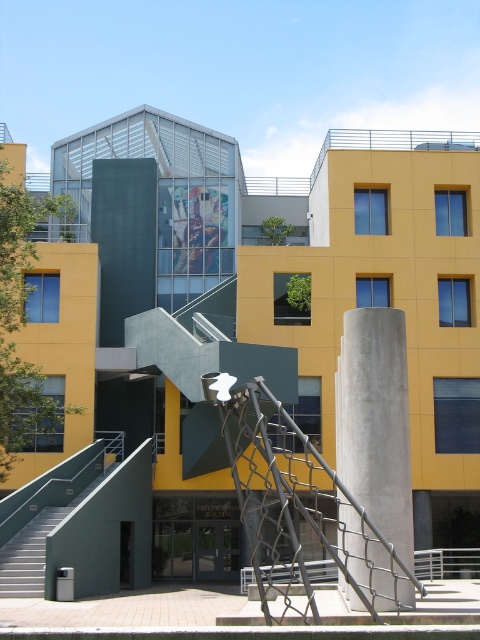
Question: Is concrete at center below smooth concrete stairs at lower left?

Choices:
 (A) no
 (B) yes

Answer: (A)

Question: Among these objects, which one is farthest from the camera?

Choices:
 (A) concrete at center
 (B) smooth concrete stairs at lower left

Answer: (B)

Question: Which point appears closest to the camera in this image?

Choices:
 (A) (338, 385)
 (B) (3, 572)

Answer: (A)

Question: Which object appears closest to the camera in this image?

Choices:
 (A) concrete at center
 (B) smooth concrete stairs at lower left

Answer: (A)

Question: Is concrete at center smaller than smooth concrete stairs at lower left?

Choices:
 (A) yes
 (B) no

Answer: (B)

Question: Is concrete at center to the right of smooth concrete stairs at lower left from the viewer's perspective?

Choices:
 (A) yes
 (B) no

Answer: (A)